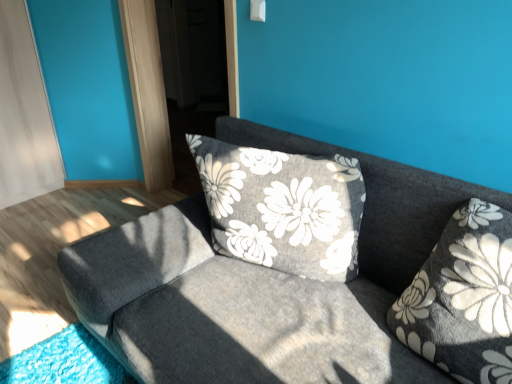
Question: Considering the relative sizes of textured gray couch at center and transparent glass screen door at upper center in the image provided, is textured gray couch at center thinner than transparent glass screen door at upper center?

Choices:
 (A) yes
 (B) no

Answer: (B)

Question: Are textured gray couch at center and transparent glass screen door at upper center located far from each other?

Choices:
 (A) yes
 (B) no

Answer: (A)

Question: Is textured gray couch at center facing away from transparent glass screen door at upper center?

Choices:
 (A) yes
 (B) no

Answer: (B)

Question: Is textured gray couch at center facing towards transparent glass screen door at upper center?

Choices:
 (A) yes
 (B) no

Answer: (B)

Question: Considering the relative sizes of textured gray couch at center and transparent glass screen door at upper center in the image provided, is textured gray couch at center bigger than transparent glass screen door at upper center?

Choices:
 (A) no
 (B) yes

Answer: (B)

Question: Is textured gray couch at center wider or thinner than transparent glass screen door at upper center?

Choices:
 (A) wide
 (B) thin

Answer: (A)

Question: Relative to transparent glass screen door at upper center, is textured gray couch at center in front or behind?

Choices:
 (A) behind
 (B) front

Answer: (B)

Question: Would you say textured gray couch at center is inside or outside transparent glass screen door at upper center?

Choices:
 (A) outside
 (B) inside

Answer: (A)

Question: From a real-world perspective, relative to transparent glass screen door at upper center, is textured gray couch at center vertically above or below?

Choices:
 (A) above
 (B) below

Answer: (B)

Question: Based on their sizes in the image, would you say textured gray couch at center is bigger or smaller than fluffy gray pillow at right?

Choices:
 (A) small
 (B) big

Answer: (B)

Question: From their relative heights in the image, would you say textured gray couch at center is taller or shorter than fluffy gray pillow at right?

Choices:
 (A) short
 (B) tall

Answer: (B)

Question: Which is correct: textured gray couch at center is inside fluffy gray pillow at right, or outside of it?

Choices:
 (A) outside
 (B) inside

Answer: (A)

Question: From a real-world perspective, is textured gray couch at center above or below fluffy gray pillow at right?

Choices:
 (A) below
 (B) above

Answer: (A)

Question: Is transparent glass screen door at upper center situated inside fluffy gray pillow at right or outside?

Choices:
 (A) outside
 (B) inside

Answer: (A)

Question: In terms of width, does transparent glass screen door at upper center look wider or thinner when compared to fluffy gray pillow at right?

Choices:
 (A) thin
 (B) wide

Answer: (A)